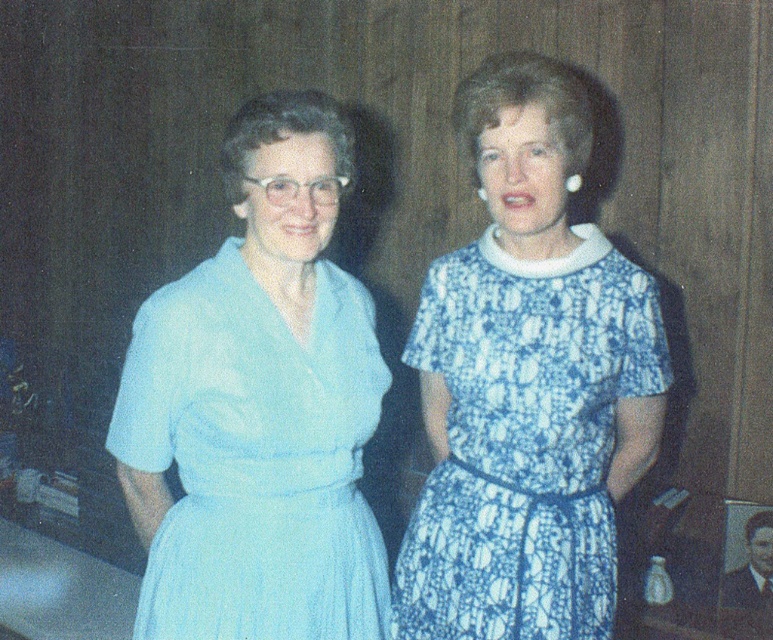
Which is behind, point (169, 316) or point (530, 499)?

Point (530, 499)

Can you confirm if light blue fabric dress at left is taller than blue printed dress at center?

Indeed, light blue fabric dress at left has a greater height compared to blue printed dress at center.

Find the location of a particular element. This screenshot has width=773, height=640. light blue fabric dress at left is located at coordinates (259, 404).